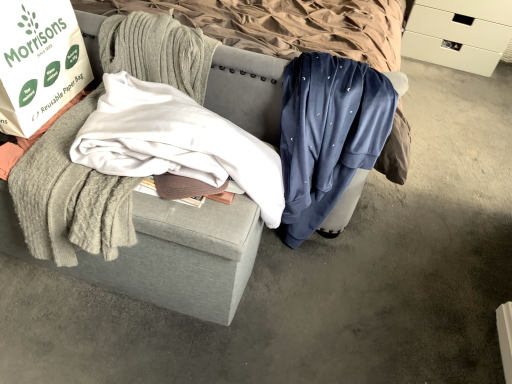
Describe the element at coordinates (459, 33) in the screenshot. Image resolution: width=512 pixels, height=384 pixels. I see `white matte drawer at upper right` at that location.

What is the approximate width of white matte drawer at upper right?

It is 24.00 inches.

The height and width of the screenshot is (384, 512). Describe the element at coordinates (328, 134) in the screenshot. I see `velvet blue sweatpants at center, acting as the 1th clothing starting from the right` at that location.

Identify the location of velvet blue sweatpants at center, acting as the 1th clothing starting from the right. The width and height of the screenshot is (512, 384). pyautogui.click(x=328, y=134).

You are a GUI agent. You are given a task and a screenshot of the screen. Output one action in this format:
    pyautogui.click(x=<x>, y=<y>)
    Task: Click on the textured gray ottoman at center
    
    Given the screenshot: What is the action you would take?
    pyautogui.click(x=184, y=258)

Does white cotton shirt at center, the second clothing when ordered from right to left, touch velvet blue sweatpants at center, acting as the 1th clothing starting from the right?

There is a gap between white cotton shirt at center, the second clothing when ordered from right to left, and velvet blue sweatpants at center, acting as the 1th clothing starting from the right.

In the scene shown: Considering their positions, is white cotton shirt at center, the second clothing when ordered from right to left, located in front of or behind velvet blue sweatpants at center, which is counted as the second clothing, starting from the left?

In the image, white cotton shirt at center, the second clothing when ordered from right to left, appears in front of velvet blue sweatpants at center, which is counted as the second clothing, starting from the left.

What's the angular difference between white cotton shirt at center, the 1th clothing from the left, and velvet blue sweatpants at center, which is counted as the second clothing, starting from the left,'s facing directions?

There is a 0.194-degree angle between the facing directions of white cotton shirt at center, the 1th clothing from the left, and velvet blue sweatpants at center, which is counted as the second clothing, starting from the left.

Does point (105, 120) appear closer or farther from the camera than point (388, 123)?

Point (105, 120) is closer to the camera than point (388, 123).

Is velvet blue sweatpants at center, acting as the 1th clothing starting from the right, to the left or to the right of textured gray ottoman at center in the image?

Clearly, velvet blue sweatpants at center, acting as the 1th clothing starting from the right, is on the left of textured gray ottoman at center in the image.

Is there a large distance between velvet blue sweatpants at center, acting as the 1th clothing starting from the right, and textured gray ottoman at center?

That's not correct — velvet blue sweatpants at center, acting as the 1th clothing starting from the right, is a little close to textured gray ottoman at center.

Considering the relative sizes of velvet blue sweatpants at center, which is counted as the second clothing, starting from the left, and textured gray ottoman at center in the image provided, is velvet blue sweatpants at center, which is counted as the second clothing, starting from the left, smaller than textured gray ottoman at center?

Indeed, velvet blue sweatpants at center, which is counted as the second clothing, starting from the left, has a smaller size compared to textured gray ottoman at center.

From the image's perspective, is velvet blue sweatpants at center, acting as the 1th clothing starting from the right, located beneath textured gray ottoman at center?

Yes, from the image's perspective, velvet blue sweatpants at center, acting as the 1th clothing starting from the right, is beneath textured gray ottoman at center.

Considering the points (370, 67) and (187, 114), which point is behind, point (370, 67) or point (187, 114)?

Positioned behind is point (370, 67).

Is velvet blue sweatpants at center, acting as the 1th clothing starting from the right, in front of or behind white cotton shirt at center, the 1th clothing from the left, in the image?

velvet blue sweatpants at center, acting as the 1th clothing starting from the right, is behind white cotton shirt at center, the 1th clothing from the left.

Based on the photo, can you confirm if velvet blue sweatpants at center, acting as the 1th clothing starting from the right, is shorter than white cotton shirt at center, the 1th clothing from the left?

Incorrect, the height of velvet blue sweatpants at center, acting as the 1th clothing starting from the right, does not fall short of that of white cotton shirt at center, the 1th clothing from the left.

Based on their sizes in the image, would you say white cotton shirt at center, the 1th clothing from the left, is bigger or smaller than white matte drawer at upper right?

white cotton shirt at center, the 1th clothing from the left, is smaller than white matte drawer at upper right.

Does white cotton shirt at center, the 1th clothing from the left, turn towards white matte drawer at upper right?

No, white cotton shirt at center, the 1th clothing from the left, does not turn towards white matte drawer at upper right.

Is white cotton shirt at center, the 1th clothing from the left, wider or thinner than white matte drawer at upper right?

Clearly, white cotton shirt at center, the 1th clothing from the left, has less width compared to white matte drawer at upper right.

Is point (272, 156) farther from viewer compared to point (511, 0)?

No, (272, 156) is closer to viewer.

How different are the orientations of white paper bag at left and textured gray ottoman at center in degrees?

89.2 degrees.

Locate an element on the screen. This screenshot has height=384, width=512. box that is above the textured gray ottoman at center (from a real-world perspective) is located at coordinates (x=38, y=63).

Could you tell me if white paper bag at left is turned towards textured gray ottoman at center?

No.

Which is correct: white paper bag at left is inside textured gray ottoman at center, or outside of it?

The correct answer is: outside.

Which is in front, point (111, 126) or point (95, 272)?

The point (111, 126) is closer to the camera.

Choose the correct answer: Is white cotton shirt at center, the 1th clothing from the left, inside textured gray ottoman at center or outside it?

white cotton shirt at center, the 1th clothing from the left, is located beyond the bounds of textured gray ottoman at center.

Would you consider white cotton shirt at center, the second clothing when ordered from right to left, to be distant from textured gray ottoman at center?

Actually, white cotton shirt at center, the second clothing when ordered from right to left, and textured gray ottoman at center are a little close together.

Is textured gray ottoman at center at the back of white cotton shirt at center, the 1th clothing from the left?

No.

Considering the relative positions of textured gray ottoman at center and velvet blue sweatpants at center, which is counted as the second clothing, starting from the left, in the image provided, is textured gray ottoman at center to the left or to the right of velvet blue sweatpants at center, which is counted as the second clothing, starting from the left,?

Clearly, textured gray ottoman at center is on the right of velvet blue sweatpants at center, which is counted as the second clothing, starting from the left, in the image.

In the image, is textured gray ottoman at center positioned in front of or behind velvet blue sweatpants at center, acting as the 1th clothing starting from the right?

Clearly, textured gray ottoman at center is in front of velvet blue sweatpants at center, acting as the 1th clothing starting from the right.

From a real-world perspective, who is located lower, textured gray ottoman at center or velvet blue sweatpants at center, which is counted as the second clothing, starting from the left?

textured gray ottoman at center is physically lower.

This screenshot has height=384, width=512. There is a textured gray ottoman at center. In order to click on the 1st clothing below it (from the image's perspective) in this screenshot , I will do pos(328,134).

The width and height of the screenshot is (512, 384). What are the coordinates of `clothing lying in front of the velvet blue sweatpants at center, acting as the 1th clothing starting from the right` in the screenshot? It's located at (176, 142).

You are a GUI agent. You are given a task and a screenshot of the screen. Output one action in this format:
    pyautogui.click(x=<x>, y=<y>)
    Task: Click on the 1st clothing positioned above the textured gray ottoman at center (from a real-world perspective)
    The width and height of the screenshot is (512, 384).
    Given the screenshot: What is the action you would take?
    pyautogui.click(x=328, y=134)

When comparing their distances from velvet blue sweatpants at center, acting as the 1th clothing starting from the right, does white cotton shirt at center, the second clothing when ordered from right to left, or white paper bag at left seem further?

Among the two, white paper bag at left is located further to velvet blue sweatpants at center, acting as the 1th clothing starting from the right.

When comparing their distances from white matte drawer at upper right, does white paper bag at left or velvet blue sweatpants at center, which is counted as the second clothing, starting from the left, seem further?

white paper bag at left is positioned further to the anchor white matte drawer at upper right.

Based on their spatial positions, is white matte drawer at upper right or white paper bag at left closer to velvet blue sweatpants at center, acting as the 1th clothing starting from the right?

Among the two, white paper bag at left is located nearer to velvet blue sweatpants at center, acting as the 1th clothing starting from the right.

Estimate the real-world distances between objects in this image. Which object is closer to white matte drawer at upper right, white paper bag at left or white cotton shirt at center, the 1th clothing from the left?

white cotton shirt at center, the 1th clothing from the left, lies closer to white matte drawer at upper right than the other object.

Based on their spatial positions, is textured gray ottoman at center or white matte drawer at upper right closer to white cotton shirt at center, the second clothing when ordered from right to left?

textured gray ottoman at center.

Which object lies nearer to the anchor point white paper bag at left, velvet blue sweatpants at center, acting as the 1th clothing starting from the right, or textured gray ottoman at center?

textured gray ottoman at center lies closer to white paper bag at left than the other object.

From the image, which object appears to be farther from white cotton shirt at center, the second clothing when ordered from right to left, textured gray ottoman at center or white paper bag at left?

white paper bag at left.

Estimate the real-world distances between objects in this image. Which object is closer to white matte drawer at upper right, white paper bag at left or textured gray ottoman at center?

textured gray ottoman at center is closer to white matte drawer at upper right.

The image size is (512, 384). What are the coordinates of `furniture between white paper bag at left and white matte drawer at upper right in the horizontal direction` in the screenshot? It's located at (184, 258).

This screenshot has height=384, width=512. I want to click on clothing between white paper bag at left and velvet blue sweatpants at center, which is counted as the second clothing, starting from the left, so click(x=176, y=142).

Find the location of a particular element. clothing between white cotton shirt at center, the second clothing when ordered from right to left, and white matte drawer at upper right, along the z-axis is located at coordinates (328, 134).

Locate an element on the screen. This screenshot has width=512, height=384. clothing located between white cotton shirt at center, the second clothing when ordered from right to left, and textured gray ottoman at center in the left-right direction is located at coordinates (328, 134).